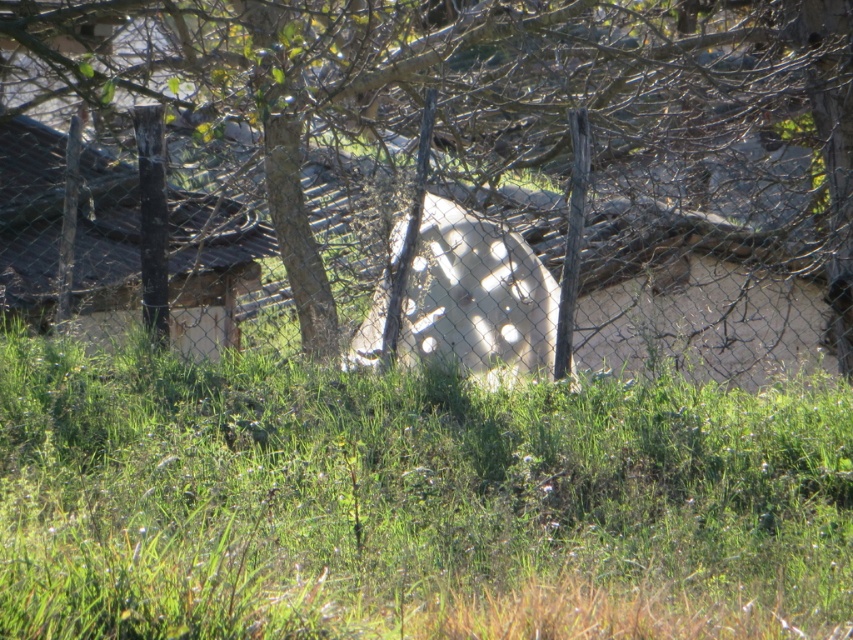
Looking at this image, can you confirm if green grassy at center is wider than white matte concrete wheel at center?

Correct, the width of green grassy at center exceeds that of white matte concrete wheel at center.

Consider the image. Between green grassy at center and white matte concrete wheel at center, which one appears on the left side from the viewer's perspective?

From the viewer's perspective, white matte concrete wheel at center appears more on the left side.

Identify the location of green grassy at center. Image resolution: width=853 pixels, height=640 pixels. [x=410, y=502].

Can you confirm if green leafy tree at center is thinner than green grassy at center?

Incorrect, green leafy tree at center's width is not less than green grassy at center's.

Does point (525, 147) come behind point (200, 449)?

Yes, point (525, 147) is behind point (200, 449).

In order to click on green leafy tree at center in this screenshot , I will do `click(511, 163)`.

Find the location of `green leafy tree at center`. green leafy tree at center is located at coordinates (511, 163).

Does green leafy tree at center appear on the left side of white matte concrete wheel at center?

No, green leafy tree at center is not to the left of white matte concrete wheel at center.

Image resolution: width=853 pixels, height=640 pixels. Find the location of `green leafy tree at center`. green leafy tree at center is located at coordinates (511, 163).

Where is `green leafy tree at center`? The width and height of the screenshot is (853, 640). green leafy tree at center is located at coordinates (511, 163).